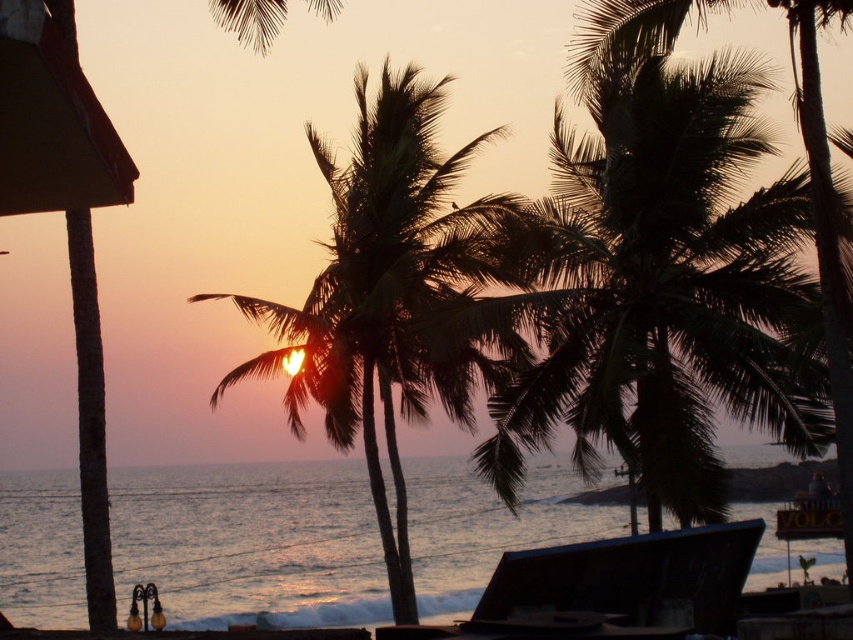
Does silvery water at center appear on the right side of silhouette leafy palm at center?

Incorrect, silvery water at center is not on the right side of silhouette leafy palm at center.

Who is higher up, silvery water at center or silhouette leafy palm at center?

silhouette leafy palm at center is above.

Find the location of `silvery water at center`. silvery water at center is located at coordinates (250, 544).

Does dark green leafy palm tree at center have a lesser width compared to silhouette leafy palm at center?

Yes.

Can you confirm if dark green leafy palm tree at center is shorter than silhouette leafy palm at center?

Correct, dark green leafy palm tree at center is not as tall as silhouette leafy palm at center.

Between point (608, 333) and point (456, 205), which one is positioned in front?

Point (608, 333) is more forward.

Where is `dark green leafy palm tree at center`? The height and width of the screenshot is (640, 853). dark green leafy palm tree at center is located at coordinates (665, 289).

Can you confirm if dark green leafy palm tree at center is positioned below silvery water at center?

No, dark green leafy palm tree at center is not below silvery water at center.

Who is taller, dark green leafy palm tree at center or silvery water at center?

With more height is silvery water at center.

Between point (683, 269) and point (64, 525), which one is positioned behind?

The point (64, 525) is more distant.

Where is `dark green leafy palm tree at center`? dark green leafy palm tree at center is located at coordinates (665, 289).